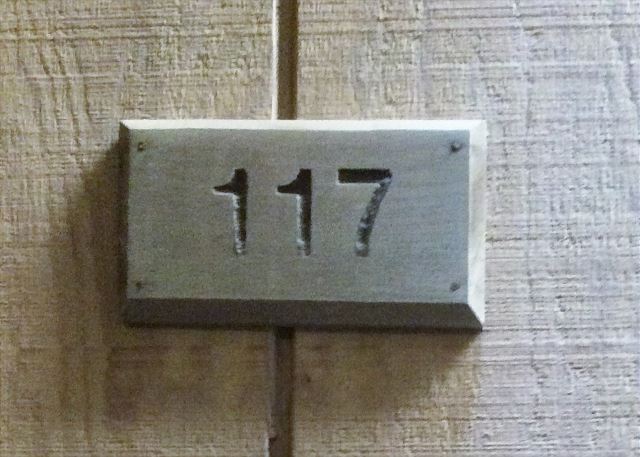
Identify the location of wall. The height and width of the screenshot is (457, 640). (157, 57).